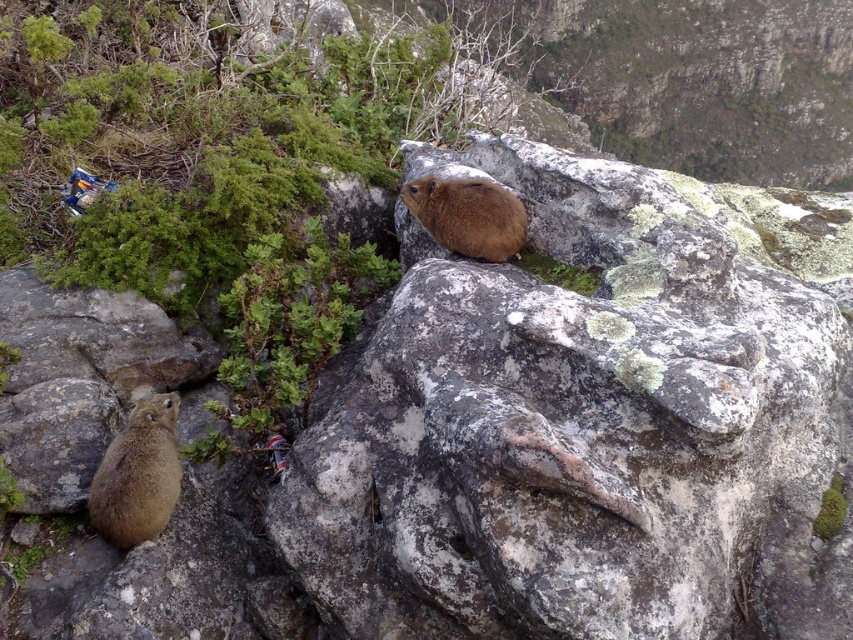
You are observing a rocky mountain terrain and notice a brown furry squirrel at lower left and a brown furry rock hyrax at center. Which animal is positioned farther to the left side of the scene?

The brown furry squirrel at lower left is farther to the left than the brown furry rock hyrax at center.

You are a hiker standing at the base of the cliff looking up. You see a brown furry squirrel at lower left and a brown furry rock hyrax at center. Which animal is closer to you?

The brown furry squirrel at lower left is closer to you because it is in front of the brown furry rock hyrax at center.

You are a hiker who wants to take a photo of the brown furry squirrel at lower left and the brown furry rock hyrax at center. Which animal should you focus on first if you want to capture both in the same frame without changing your camera angle?

You should focus on the brown furry rock hyrax at center first because it is higher up and the brown furry squirrel at lower left is positioned under it, so adjusting focus from top to bottom would ensure both are in frame.